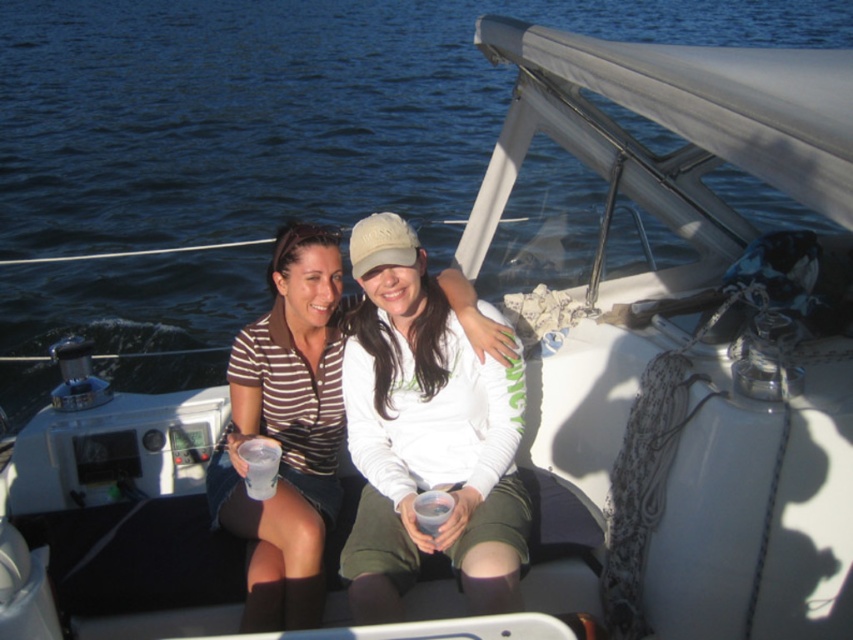
Between striped fabric shirt at center and striped jersey at center, which one appears on the left side from the viewer's perspective?

striped fabric shirt at center is more to the left.

Is striped fabric shirt at center further to the viewer compared to striped jersey at center?

Yes, it is.

Who is more distant from viewer, (331,420) or (267,598)?

The point (331,420) is behind.

At what (x,y) coordinates should I click in order to perform the action: click on striped fabric shirt at center. Please return your answer as a coordinate pair (x, y). The width and height of the screenshot is (853, 640). Looking at the image, I should click on (286, 442).

In the scene shown: Measure the distance from striped jersey at center to translucent plastic cup at center.

striped jersey at center is 28.20 inches away from translucent plastic cup at center.

Find the location of a particular element. Image resolution: width=853 pixels, height=640 pixels. striped jersey at center is located at coordinates (286, 432).

Identify the location of striped jersey at center. (286, 432).

What are the coordinates of `striped jersey at center` in the screenshot? It's located at (286, 432).

Who is higher up, striped jersey at center or clear plastic cup at center?

Positioned higher is striped jersey at center.

I want to click on striped jersey at center, so point(286,432).

Locate an element on the screen. This screenshot has height=640, width=853. striped jersey at center is located at coordinates (286, 432).